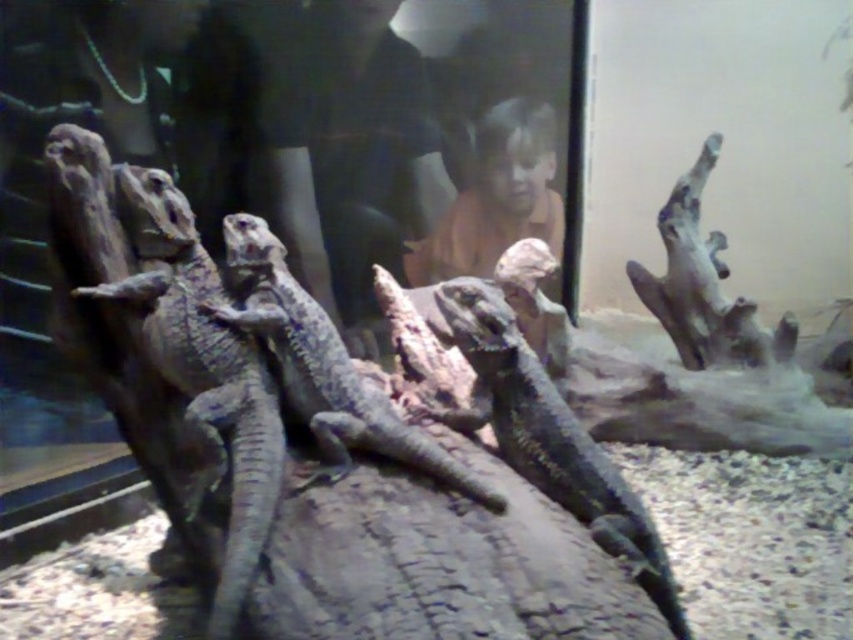
Locate an element on the screen. scaly gray lizard at left is located at coordinates (202, 372).

Which of these two, scaly gray lizard at left or scaly gray lizard at center, stands shorter?

Standing shorter between the two is scaly gray lizard at center.

Does point (192, 488) come farther from viewer compared to point (337, 333)?

No, it is not.

Find the location of a particular element. scaly gray lizard at left is located at coordinates (202, 372).

Does shiny black lizard at center have a lesser height compared to scaly gray lizard at center?

In fact, shiny black lizard at center may be taller than scaly gray lizard at center.

This screenshot has height=640, width=853. What do you see at coordinates (554, 438) in the screenshot?
I see `shiny black lizard at center` at bounding box center [554, 438].

Locate an element on the screen. shiny black lizard at center is located at coordinates (554, 438).

Which is in front, point (227, 432) or point (495, 419)?

Point (227, 432)

Locate an element on the screen. The image size is (853, 640). scaly gray lizard at left is located at coordinates (202, 372).